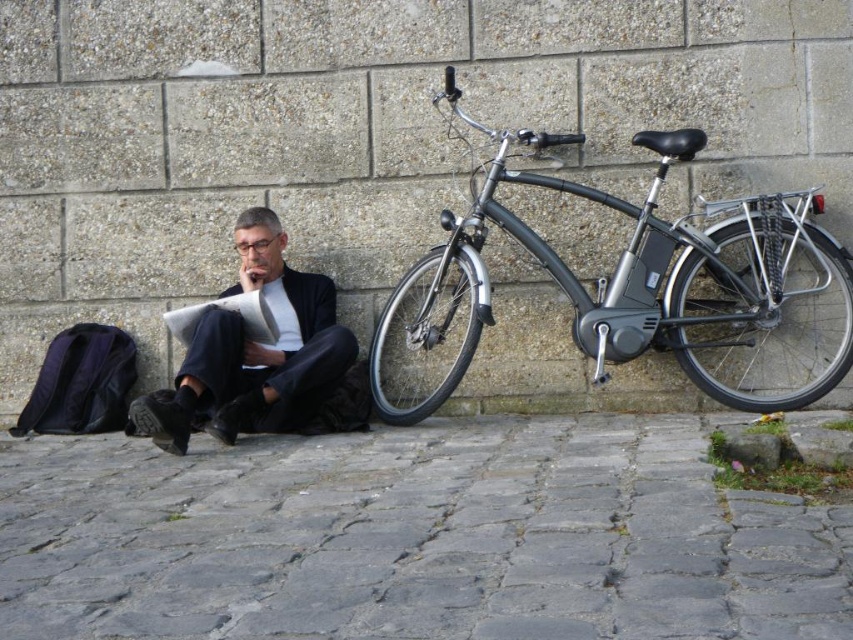
Can you confirm if gray stone pavement at lower center is taller than shiny metallic bicycle at right?

Incorrect, gray stone pavement at lower center's height is not larger of shiny metallic bicycle at right's.

Does point (395, 560) come behind point (798, 310)?

No, (395, 560) is in front of (798, 310).

Find the location of a particular element. gray stone pavement at lower center is located at coordinates (413, 538).

Which is in front, point (727, 620) or point (161, 420)?

Point (727, 620) is in front.

Is point (671, 419) closer to camera compared to point (310, 388)?

No, it is not.

At what (x,y) coordinates should I click in order to perform the action: click on gray stone pavement at lower center. Please return your answer as a coordinate pair (x, y). Image resolution: width=853 pixels, height=640 pixels. Looking at the image, I should click on (413, 538).

Who is more forward, (741,212) or (273,353)?

Point (273,353) is in front.

Is shiny metallic bicycle at right wider than black fabric suit at center?

Correct, the width of shiny metallic bicycle at right exceeds that of black fabric suit at center.

Does point (764, 236) come closer to viewer compared to point (297, 417)?

No, it is behind (297, 417).

In order to click on shiny metallic bicycle at right in this screenshot , I will do `click(634, 289)`.